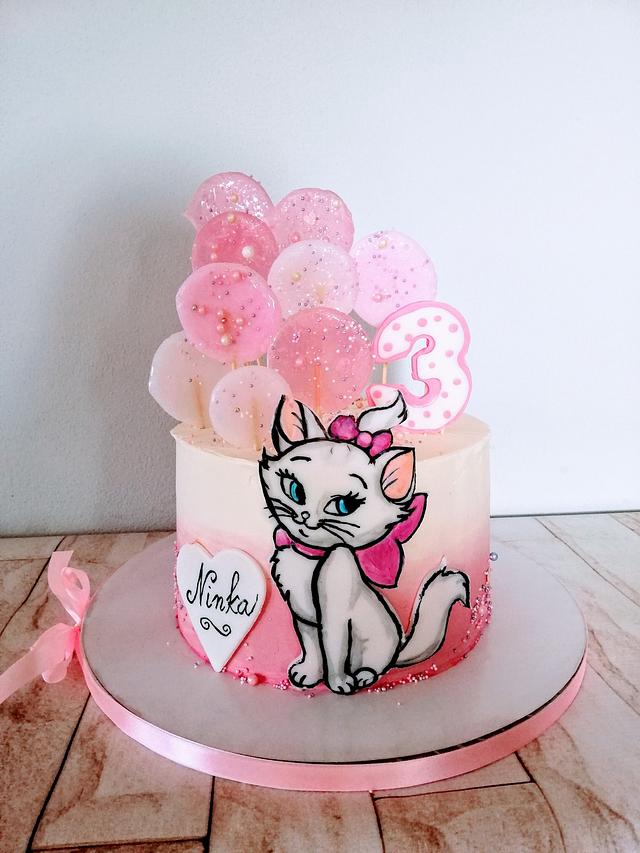
What are the coordinates of `white wall behind cake` in the screenshot? It's located at tap(100, 415).